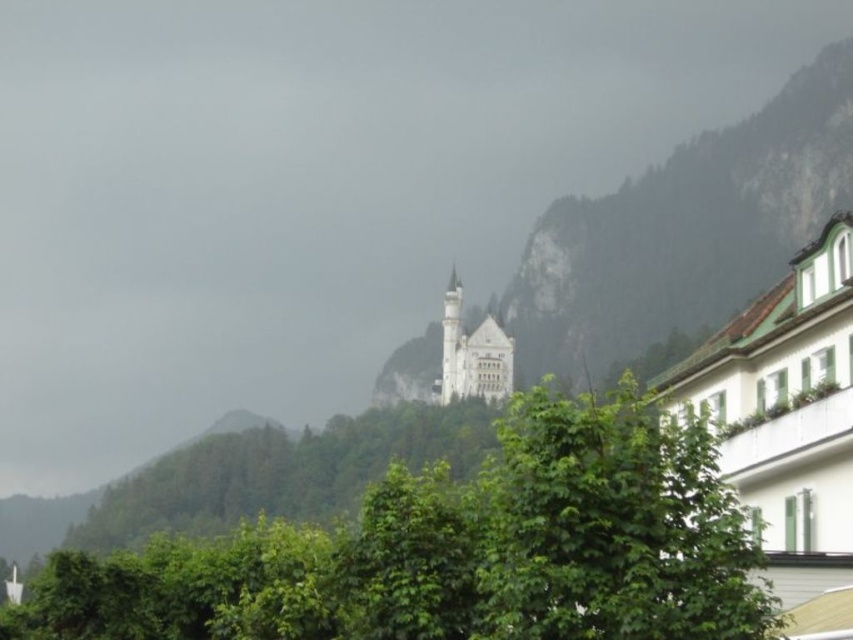
Which is behind, point (370, 612) or point (689, 314)?

Point (689, 314)

Which is in front, point (428, 577) or point (730, 182)?

Positioned in front is point (428, 577).

Measure the distance between green leafy tree at center and camera.

They are 30.98 meters apart.

Where is `green leafy tree at center`? Image resolution: width=853 pixels, height=640 pixels. green leafy tree at center is located at coordinates (457, 550).